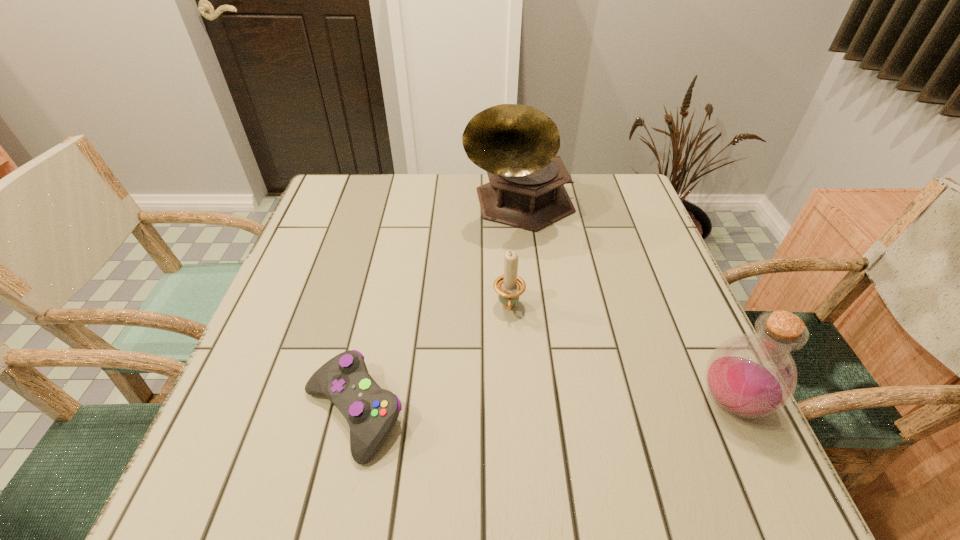
The height and width of the screenshot is (540, 960). What are the coordinates of `vacant space located 0.090m on the handle side of the second shortest object` in the screenshot? It's located at (510, 358).

Where is `vacant space located 0.110m on the handle side of the second shortest object`? vacant space located 0.110m on the handle side of the second shortest object is located at coordinates (510, 367).

Locate an element on the screen. This screenshot has width=960, height=540. vacant area situated 0.210m on the handle side of the second shortest object is located at coordinates (511, 414).

The height and width of the screenshot is (540, 960). I want to click on vacant space positioned on the horn direction of the tallest object, so click(564, 340).

Locate an element on the screen. The height and width of the screenshot is (540, 960). vacant space located 0.220m on the horn direction of the tallest object is located at coordinates (553, 307).

This screenshot has width=960, height=540. Identify the location of vacant space located 0.110m on the horn direction of the tallest object. (541, 273).

Identify the location of object that is at the far edge. (516, 144).

You are a GUI agent. You are given a task and a screenshot of the screen. Output one action in this format:
    pyautogui.click(x=<x>, y=<y>)
    Task: Click on the control that is at the near edge
    Image resolution: width=960 pixels, height=540 pixels.
    Given the screenshot: What is the action you would take?
    pyautogui.click(x=371, y=412)

In order to click on bottle situated at the near edge in this screenshot , I will do `click(753, 375)`.

Find the location of a particular element. object that is at the left edge is located at coordinates (371, 412).